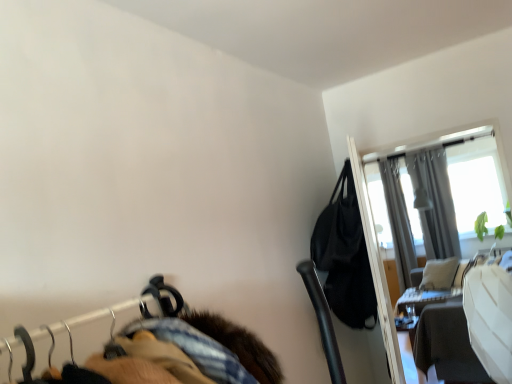
How much space does gray fabric curtain at upper right, acting as the 2th curtain starting from the right, occupy vertically?

The height of gray fabric curtain at upper right, acting as the 2th curtain starting from the right, is 2.23 meters.

Describe the element at coordinates (398, 222) in the screenshot. This screenshot has height=384, width=512. I see `gray fabric curtain at upper right, the 1th curtain positioned from the left` at that location.

At what (x,y) coordinates should I click in order to perform the action: click on black leather bag at upper right. Please return your answer as a coordinate pair (x, y). Looking at the image, I should click on (344, 256).

Considering the sizes of gray fabric curtain at upper right, the 1th curtain positioned from the left, and black leather bag at upper right in the image, is gray fabric curtain at upper right, the 1th curtain positioned from the left, taller or shorter than black leather bag at upper right?

Considering their sizes, gray fabric curtain at upper right, the 1th curtain positioned from the left, has more height than black leather bag at upper right.

Is gray fabric curtain at upper right, the 1th curtain positioned from the left, to the left of black leather bag at upper right from the viewer's perspective?

In fact, gray fabric curtain at upper right, the 1th curtain positioned from the left, is to the right of black leather bag at upper right.

Considering the sizes of objects gray fabric curtain at upper right, acting as the 2th curtain starting from the right, and black leather bag at upper right in the image provided, who is smaller, gray fabric curtain at upper right, acting as the 2th curtain starting from the right, or black leather bag at upper right?

black leather bag at upper right is smaller.

Does gray fabric curtain at upper right, arranged as the 1th curtain when viewed from the right, have a lesser height compared to wooden table at right?

No.

Considering their positions, is gray fabric curtain at upper right, arranged as the 1th curtain when viewed from the right, located in front of or behind wooden table at right?

gray fabric curtain at upper right, arranged as the 1th curtain when viewed from the right, is positioned farther from the viewer than wooden table at right.

Does gray fabric curtain at upper right, the 2th curtain positioned from the left, have a smaller size compared to wooden table at right?

No, gray fabric curtain at upper right, the 2th curtain positioned from the left, is not smaller than wooden table at right.

From a real-world perspective, is gray fabric curtain at upper right, arranged as the 1th curtain when viewed from the right, physically below wooden table at right?

Incorrect, from a real-world perspective, gray fabric curtain at upper right, arranged as the 1th curtain when viewed from the right, is higher than wooden table at right.

Based on the photo, who is bigger, black leather bag at upper right or gray fabric curtain at upper right, arranged as the 1th curtain when viewed from the right?

gray fabric curtain at upper right, arranged as the 1th curtain when viewed from the right.

From a real-world perspective, relative to gray fabric curtain at upper right, arranged as the 1th curtain when viewed from the right, is black leather bag at upper right vertically above or below?

black leather bag at upper right is below gray fabric curtain at upper right, arranged as the 1th curtain when viewed from the right.

Is black leather bag at upper right taller than gray fabric curtain at upper right, arranged as the 1th curtain when viewed from the right?

Incorrect, the height of black leather bag at upper right is not larger of that of gray fabric curtain at upper right, arranged as the 1th curtain when viewed from the right.

Which object is wider, gray fabric curtain at upper right, acting as the 2th curtain starting from the right, or gray fabric curtain at upper right, arranged as the 1th curtain when viewed from the right?

With larger width is gray fabric curtain at upper right, acting as the 2th curtain starting from the right.

Locate an element on the screen. curtain in front of the gray fabric curtain at upper right, acting as the 2th curtain starting from the right is located at coordinates (434, 202).

Between point (410, 241) and point (437, 204), which one is positioned in front?

The point (437, 204) is more forward.

Is gray fabric curtain at upper right, acting as the 2th curtain starting from the right, far away from gray fabric curtain at upper right, arranged as the 1th curtain when viewed from the right?

gray fabric curtain at upper right, acting as the 2th curtain starting from the right, is near gray fabric curtain at upper right, arranged as the 1th curtain when viewed from the right, not far away.

Does black leather bag at upper right have a smaller size compared to gray fabric curtain at upper right, acting as the 2th curtain starting from the right?

Yes, black leather bag at upper right is smaller than gray fabric curtain at upper right, acting as the 2th curtain starting from the right.

Between point (348, 201) and point (408, 275), which one is positioned in front?

Point (348, 201)

Looking at their sizes, would you say black leather bag at upper right is wider or thinner than gray fabric curtain at upper right, the 1th curtain positioned from the left?

Clearly, black leather bag at upper right has more width compared to gray fabric curtain at upper right, the 1th curtain positioned from the left.

Locate an element on the screen. The height and width of the screenshot is (384, 512). curtain below the black leather bag at upper right (from a real-world perspective) is located at coordinates (398, 222).

How many degrees apart are the facing directions of gray fabric curtain at upper right, the 1th curtain positioned from the left, and transparent glass screen door at upper right?

The facing directions of gray fabric curtain at upper right, the 1th curtain positioned from the left, and transparent glass screen door at upper right are 3.38 degrees apart.

Can we say gray fabric curtain at upper right, the 1th curtain positioned from the left, lies outside transparent glass screen door at upper right?

gray fabric curtain at upper right, the 1th curtain positioned from the left, lies outside transparent glass screen door at upper right's area.

Does gray fabric curtain at upper right, acting as the 2th curtain starting from the right, have a lesser height compared to transparent glass screen door at upper right?

No.

Based on the photo, would you say gray fabric curtain at upper right, acting as the 2th curtain starting from the right, is to the left or to the right of transparent glass screen door at upper right in the picture?

Clearly, gray fabric curtain at upper right, acting as the 2th curtain starting from the right, is on the right of transparent glass screen door at upper right in the image.

Is transparent glass screen door at upper right turned away from gray fabric curtain at upper right, the 1th curtain positioned from the left?

That's not correct — transparent glass screen door at upper right is not looking away from gray fabric curtain at upper right, the 1th curtain positioned from the left.

Is transparent glass screen door at upper right taller or shorter than gray fabric curtain at upper right, the 1th curtain positioned from the left?

transparent glass screen door at upper right is shorter than gray fabric curtain at upper right, the 1th curtain positioned from the left.

How many degrees apart are the facing directions of transparent glass screen door at upper right and gray fabric curtain at upper right, acting as the 2th curtain starting from the right?

3.38 degrees separate the facing orientations of transparent glass screen door at upper right and gray fabric curtain at upper right, acting as the 2th curtain starting from the right.

From a real-world perspective, is transparent glass screen door at upper right physically located above or below gray fabric curtain at upper right, the 1th curtain positioned from the left?

transparent glass screen door at upper right is below gray fabric curtain at upper right, the 1th curtain positioned from the left.

Locate an element on the screen. the 1st curtain to the right when counting from the black leather bag at upper right is located at coordinates (398, 222).

From a real-world perspective, starting from the wooden table at right, which curtain is the 2nd one vertically above it? Please provide its 2D coordinates.

[(434, 202)]

From the image, which object appears to be nearer to wooden table at right, transparent glass screen door at upper right or black leather bag at upper right?

The object closer to wooden table at right is transparent glass screen door at upper right.

From the image, which object appears to be nearer to gray fabric curtain at upper right, arranged as the 1th curtain when viewed from the right, gray fabric curtain at upper right, acting as the 2th curtain starting from the right, or transparent glass screen door at upper right?

The object closer to gray fabric curtain at upper right, arranged as the 1th curtain when viewed from the right, is gray fabric curtain at upper right, acting as the 2th curtain starting from the right.

Looking at the image, which one is located closer to wooden table at right, transparent glass screen door at upper right or gray fabric curtain at upper right, acting as the 2th curtain starting from the right?

gray fabric curtain at upper right, acting as the 2th curtain starting from the right, is closer to wooden table at right.

Based on their spatial positions, is black leather bag at upper right or gray fabric curtain at upper right, arranged as the 1th curtain when viewed from the right, further from gray fabric curtain at upper right, the 1th curtain positioned from the left?

The object further to gray fabric curtain at upper right, the 1th curtain positioned from the left, is black leather bag at upper right.

When comparing their distances from transparent glass screen door at upper right, does gray fabric curtain at upper right, the 1th curtain positioned from the left, or gray fabric curtain at upper right, arranged as the 1th curtain when viewed from the right, seem closer?

Among the two, gray fabric curtain at upper right, arranged as the 1th curtain when viewed from the right, is located nearer to transparent glass screen door at upper right.

Based on their spatial positions, is gray fabric curtain at upper right, the 2th curtain positioned from the left, or wooden table at right closer to black leather bag at upper right?

The object closer to black leather bag at upper right is gray fabric curtain at upper right, the 2th curtain positioned from the left.

Looking at the image, which one is located closer to gray fabric curtain at upper right, the 2th curtain positioned from the left, wooden table at right or transparent glass screen door at upper right?

Among the two, wooden table at right is located nearer to gray fabric curtain at upper right, the 2th curtain positioned from the left.

Based on their spatial positions, is wooden table at right or gray fabric curtain at upper right, the 2th curtain positioned from the left, further from black leather bag at upper right?

wooden table at right lies further to black leather bag at upper right than the other object.

Where is `screen door located between black leather bag at upper right and gray fabric curtain at upper right, acting as the 2th curtain starting from the right, in the depth direction`? Image resolution: width=512 pixels, height=384 pixels. screen door located between black leather bag at upper right and gray fabric curtain at upper right, acting as the 2th curtain starting from the right, in the depth direction is located at coordinates (375, 225).

I want to click on curtain between black leather bag at upper right and gray fabric curtain at upper right, acting as the 2th curtain starting from the right, in the front-back direction, so click(434, 202).

What are the coordinates of `table between transparent glass screen door at upper right and gray fabric curtain at upper right, acting as the 2th curtain starting from the right, in the front-back direction` in the screenshot? It's located at 424,299.

At what (x,y) coordinates should I click in order to perform the action: click on screen door between black leather bag at upper right and wooden table at right along the z-axis. Please return your answer as a coordinate pair (x, y). The height and width of the screenshot is (384, 512). Looking at the image, I should click on (375, 225).